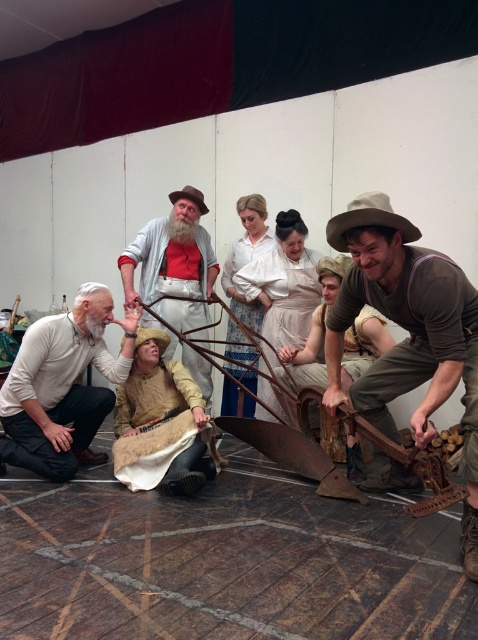
Question: Which of the following is the closest to the observer?

Choices:
 (A) brown canvas hat at center
 (B) knitted beige sweater at center
 (C) white cotton blouse at center
 (D) light beige cotton dress at center

Answer: (A)

Question: Among these objects, which one is nearest to the camera?

Choices:
 (A) white matte shirt at lower left
 (B) white cotton blouse at center

Answer: (A)

Question: Among these points, which one is nearest to the camera?

Choices:
 (A) (377, 305)
 (B) (130, 444)

Answer: (A)

Question: Considering the relative positions of brown canvas hat at center and light beige cotton dress at center in the image provided, where is brown canvas hat at center located with respect to light beige cotton dress at center?

Choices:
 (A) below
 (B) above

Answer: (A)

Question: Is white matte shirt at lower left below white cotton blouse at center?

Choices:
 (A) no
 (B) yes

Answer: (B)

Question: Can you confirm if brown canvas hat at center is positioned below knitted beige sweater at center?

Choices:
 (A) no
 (B) yes

Answer: (A)